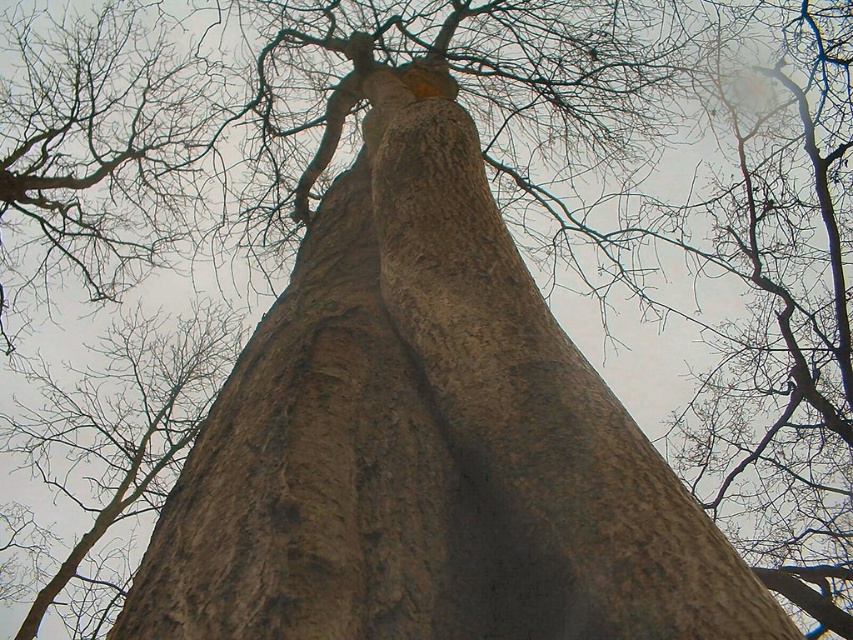
You are a park ranger measuring the distance between two sections of a tree trunk. You are standing at the base of the tree and see the smooth bark tree trunk at center and the brown rough bark at center. Which section is farther from you?

The smooth bark tree trunk at center is 6.24 meters away from the brown rough bark at center, so the smooth bark tree trunk at center is farther away from you since it is 6.24 meters away from the brown rough bark at center which is closer to you.

You are a botanist examining the tree trunk. You notice two areas of bark on the smooth bark tree trunk at center and brown rough bark at center. Which area is positioned higher up on the tree trunk?

The smooth bark tree trunk at center is positioned higher up on the tree trunk compared to the brown rough bark at center, as it is located above it.

You are standing at the base of the tree looking up. The tree trunk is at the center. Can you tell me the exact coordinates of the smooth bark tree trunk at center?

The smooth bark tree trunk at center is located at coordinates point (427, 442).